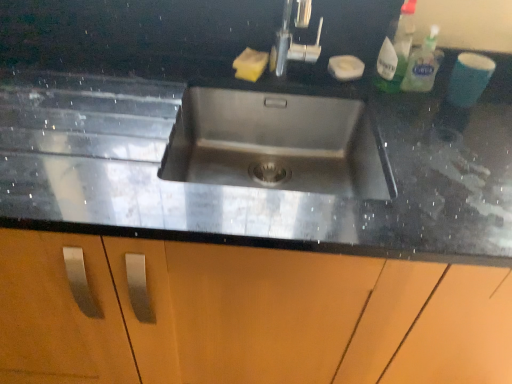
I want to click on vacant space to the left of translucent plastic spray bottle at upper right, which appears as the 1th cleaning product when viewed from the left, so click(323, 75).